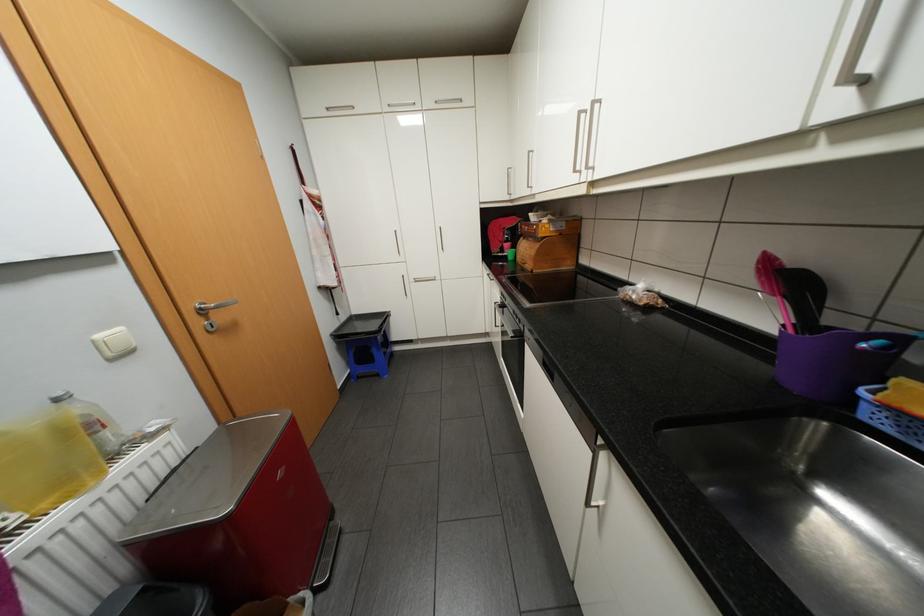
Where is `pink kitchen brush`? pink kitchen brush is located at coordinates (772, 284).